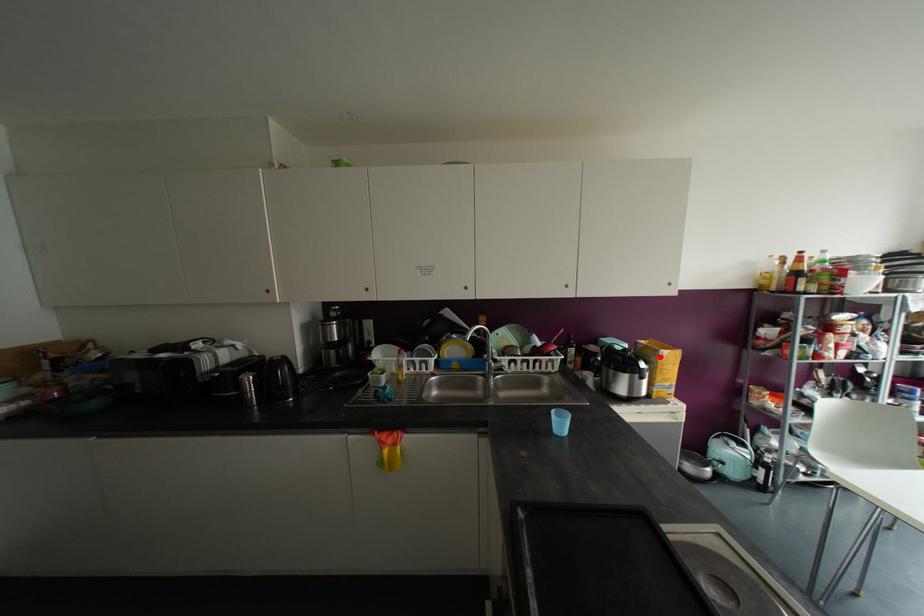
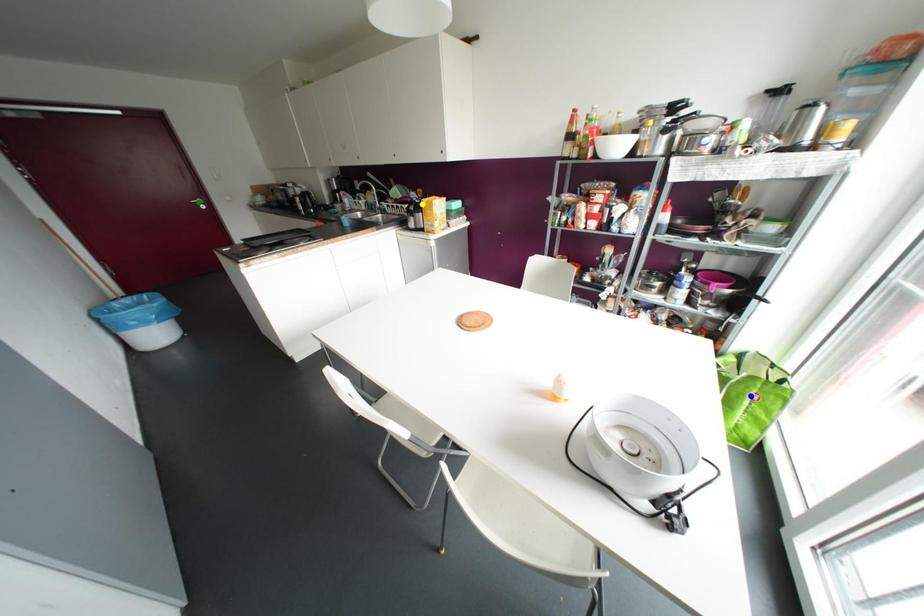
Question: I am providing you with two images of the same scene from different viewpoints. A red point is marked on the first image. You are given multiple points on the second image. Which point in image 2 represents the same 3d spot as the red point in image 1?

Choices:
 (A) green point
 (B) yellow point
 (C) blue point

Answer: (B)